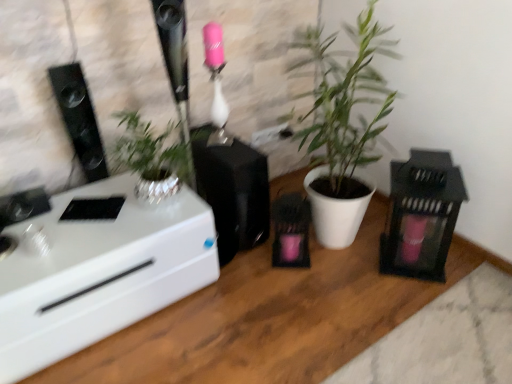
You are a GUI agent. You are given a task and a screenshot of the screen. Output one action in this format:
    pyautogui.click(x=<x>, y=<y>)
    Task: Click on the vacant area in front of white matte plant pot at center
    Image resolution: width=512 pixels, height=384 pixels.
    Given the screenshot: What is the action you would take?
    pyautogui.click(x=350, y=308)